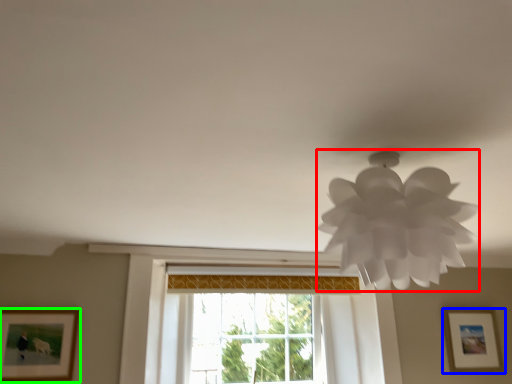
Question: Which is nearer to the lamp (highlighted by a red box)? picture frame (highlighted by a blue box) or picture frame (highlighted by a green box).

Choices:
 (A) picture frame
 (B) picture frame

Answer: (B)